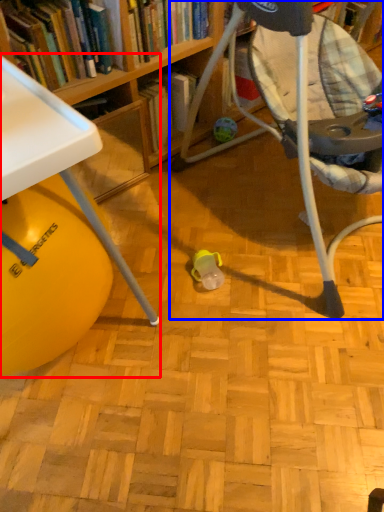
Question: Which point is closer to the camera, table (highlighted by a red box) or chair (highlighted by a blue box)?

Choices:
 (A) table
 (B) chair

Answer: (B)